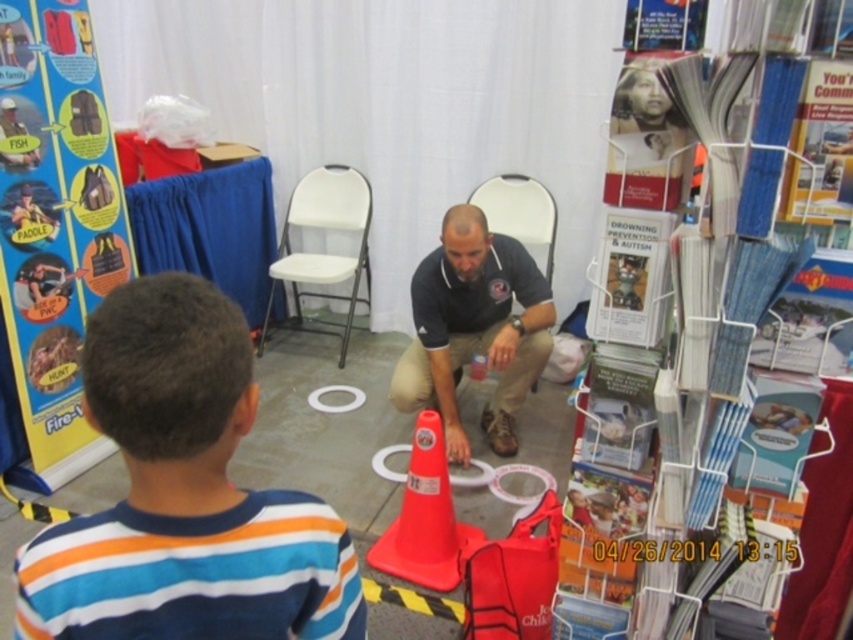
Question: Among these points, which one is farthest from the camera?

Choices:
 (A) (97, 307)
 (B) (434, 252)
 (C) (456, 538)

Answer: (B)

Question: Is orange matte traffic cone at center smaller than white plastic chair at center?

Choices:
 (A) no
 (B) yes

Answer: (B)

Question: Which point is closer to the camera?

Choices:
 (A) (402, 557)
 (B) (479, 220)
 (C) (351, 273)
 (D) (532, 237)

Answer: (A)

Question: Which object appears farthest from the camera in this image?

Choices:
 (A) matte black shirt at center
 (B) orange matte traffic cone at center
 (C) matte black chair at center

Answer: (C)

Question: Can you confirm if orange matte traffic cone at center is positioned to the left of white plastic chair at center?

Choices:
 (A) yes
 (B) no

Answer: (B)

Question: Is orange matte traffic cone at center further to the viewer compared to white plastic chair at center?

Choices:
 (A) yes
 (B) no

Answer: (B)